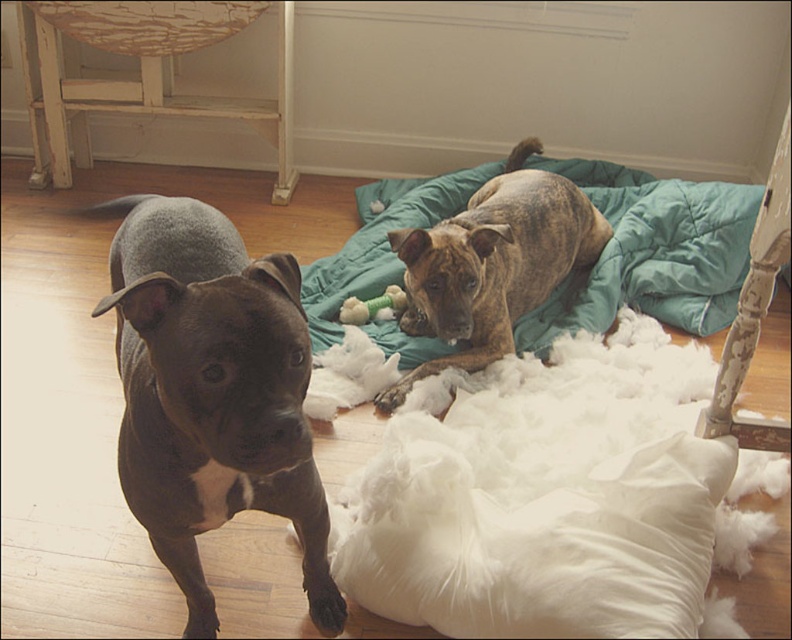
I want to click on brown brindle dog at upper center, so click(492, 264).

Is point (509, 285) behind point (379, 300)?

No, it is in front of (379, 300).

Locate an element on the screen. The image size is (792, 640). brown brindle dog at upper center is located at coordinates (492, 264).

From the picture: Does shiny brown fur at left appear on the left side of green plush toy at center?

Yes, shiny brown fur at left is to the left of green plush toy at center.

Does point (131, 244) lie behind point (364, 317)?

No, it is in front of (364, 317).

Between point (170, 518) and point (386, 301), which one is positioned in front?

Point (170, 518) is more forward.

You are a GUI agent. You are given a task and a screenshot of the screen. Output one action in this format:
    pyautogui.click(x=<x>, y=<y>)
    Task: Click on the shiny brown fur at left
    This screenshot has height=640, width=792.
    Given the screenshot: What is the action you would take?
    pyautogui.click(x=211, y=392)

Does shiny brown fur at left appear on the left side of brown brindle dog at upper center?

Correct, you'll find shiny brown fur at left to the left of brown brindle dog at upper center.

Is shiny brown fur at left taller than brown brindle dog at upper center?

Correct, shiny brown fur at left is much taller as brown brindle dog at upper center.

Which is behind, point (158, 200) or point (465, 252)?

Point (465, 252)

Image resolution: width=792 pixels, height=640 pixels. I want to click on shiny brown fur at left, so click(211, 392).